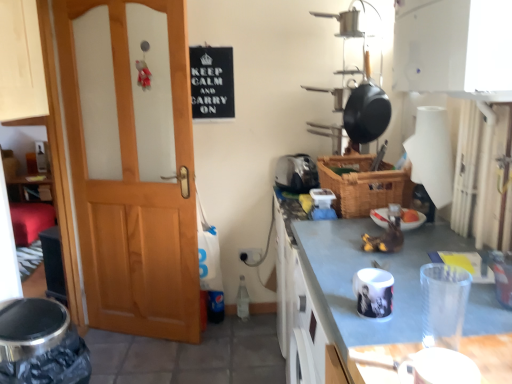
Question: Can you confirm if white glossy mug at center, the second appliance positioned from the front, is smaller than black matte sign at upper center?

Choices:
 (A) yes
 (B) no

Answer: (A)

Question: Does white glossy mug at center, the second appliance positioned from the front, have a lesser height compared to black matte sign at upper center?

Choices:
 (A) no
 (B) yes

Answer: (B)

Question: From a real-world perspective, does white glossy mug at center, the second appliance positioned from the front, stand above black matte sign at upper center?

Choices:
 (A) yes
 (B) no

Answer: (B)

Question: From the image's perspective, would you say white glossy mug at center, positioned as the third appliance in back-to-front order, is shown under black matte sign at upper center?

Choices:
 (A) no
 (B) yes

Answer: (B)

Question: Is white glossy mug at center, the second appliance positioned from the front, closer to the viewer compared to black matte sign at upper center?

Choices:
 (A) yes
 (B) no

Answer: (A)

Question: Is white glossy cabinet at upper center inside or outside of transparent plastic cup at lower right, which is counted as the fourth appliance, starting from the back?

Choices:
 (A) inside
 (B) outside

Answer: (B)

Question: In terms of height, does white glossy cabinet at upper center look taller or shorter compared to transparent plastic cup at lower right, which is counted as the fourth appliance, starting from the back?

Choices:
 (A) short
 (B) tall

Answer: (B)

Question: Considering the relative positions of white glossy cabinet at upper center and transparent plastic cup at lower right, which is counted as the fourth appliance, starting from the back, in the image provided, is white glossy cabinet at upper center to the left or to the right of transparent plastic cup at lower right, which is counted as the fourth appliance, starting from the back,?

Choices:
 (A) left
 (B) right

Answer: (B)

Question: In terms of width, does white glossy cabinet at upper center look wider or thinner when compared to transparent plastic cup at lower right, which is counted as the fourth appliance, starting from the back?

Choices:
 (A) thin
 (B) wide

Answer: (B)

Question: Would you say woven brown basket at center is inside or outside white glossy mug at center, which is counted as the fourth appliance, starting from the top?

Choices:
 (A) inside
 (B) outside

Answer: (B)

Question: Is woven brown basket at center taller or shorter than white glossy mug at center, the second appliance positioned from the front?

Choices:
 (A) tall
 (B) short

Answer: (A)

Question: In terms of width, does woven brown basket at center look wider or thinner when compared to white glossy mug at center, which is counted as the fourth appliance, starting from the top?

Choices:
 (A) wide
 (B) thin

Answer: (A)

Question: Is point (396, 198) closer or farther from the camera than point (387, 314)?

Choices:
 (A) farther
 (B) closer

Answer: (A)

Question: From the image's perspective, relative to wooden door at left, is transparent plastic cup at lower right, arranged as the first appliance when viewed from the front, above or below?

Choices:
 (A) below
 (B) above

Answer: (A)

Question: Looking at their shapes, would you say transparent plastic cup at lower right, the third appliance positioned from the top, is wider or thinner than wooden door at left?

Choices:
 (A) wide
 (B) thin

Answer: (B)